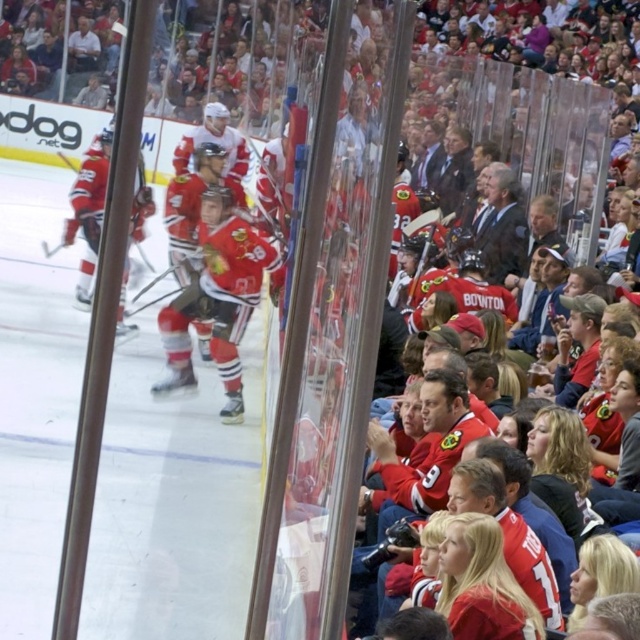
You are a photographer trying to capture a clear shot of both the red jersey at left and the red jersey hockey at center through the arena glass. Which jersey should you focus on first to ensure it appears larger in your photo?

The red jersey at left is larger than the red jersey hockey at center, so focusing on the red jersey at left first will ensure it appears larger in the photo.

You are a photographer trying to capture a clear shot of the matte jersey at center and the red jersey hockey at center through the arena glass. Which jersey should you focus on first to ensure it appears larger in your photo?

The matte jersey at center is bigger than the red jersey hockey at center, so you should focus on the matte jersey at center first to ensure it appears larger in your photo.

You are a spectator at the ice hockey game and want to know which of the two points, point (214,323) or point (234,356), is nearer to you. Based on the image, which point is closer?

Point (214,323) is closer to the viewer than point (234,356).